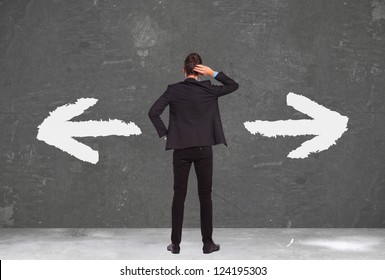
Where is `wall`? This screenshot has width=385, height=280. wall is located at coordinates (298, 195).